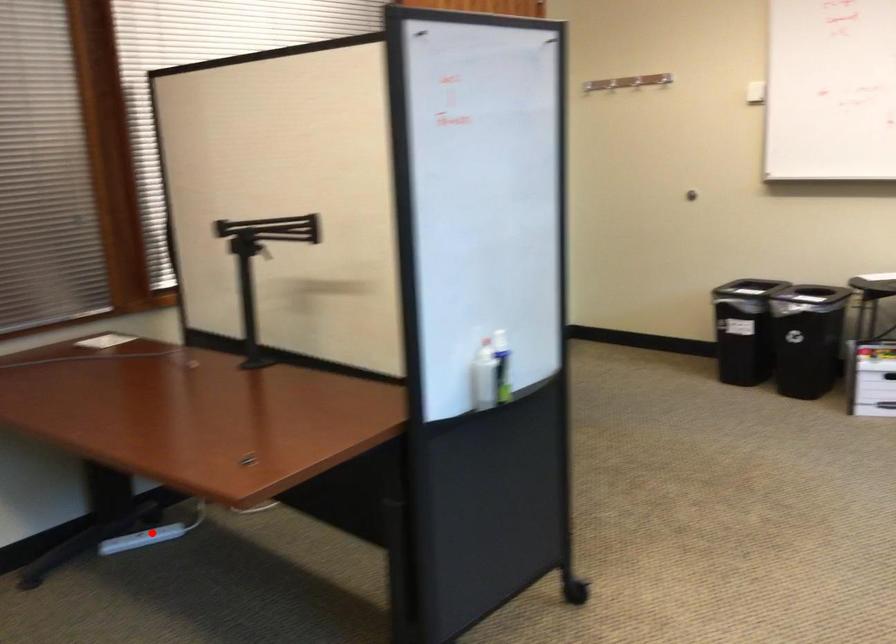
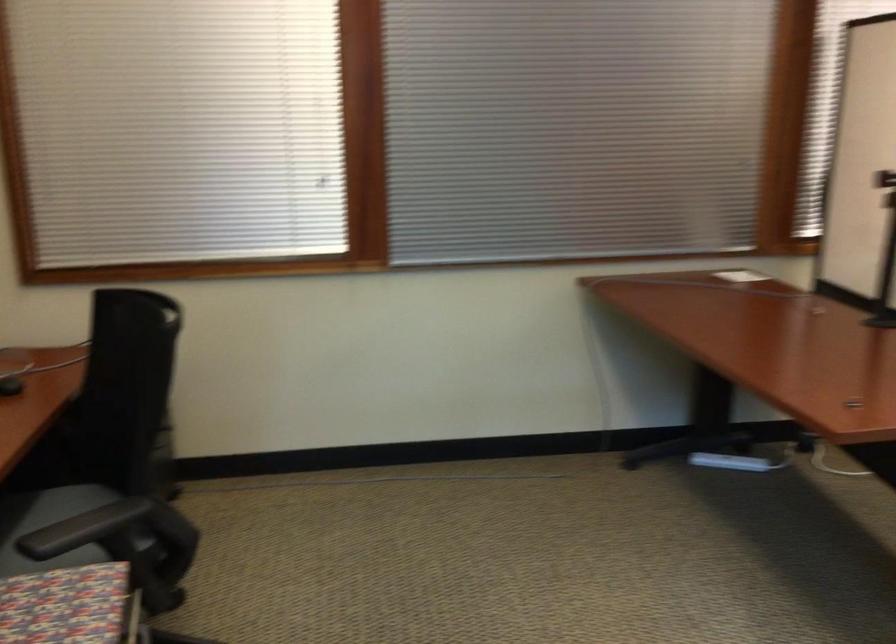
In the second image, find the point that corresponds to the highlighted location in the first image.

(730, 462)